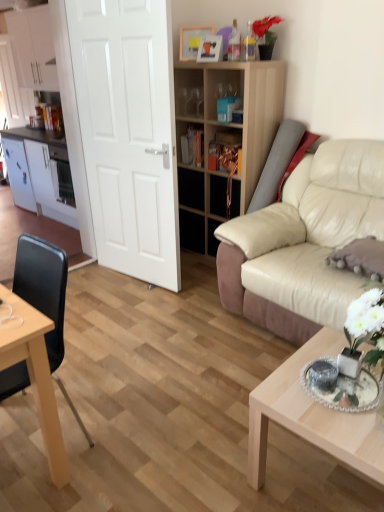
I want to click on free space to the left of beige leather couch at right, so click(x=187, y=350).